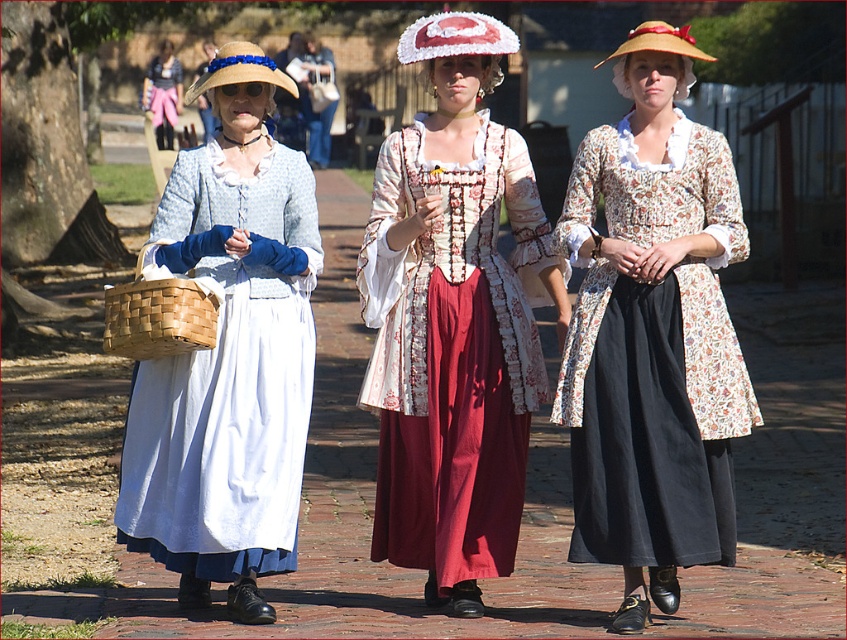
Question: Can you confirm if straw hat at center is positioned below matte blue dress at center?

Choices:
 (A) yes
 (B) no

Answer: (A)

Question: Can you confirm if straw hat at center is positioned above straw hat with blue ribbon at left?

Choices:
 (A) no
 (B) yes

Answer: (A)

Question: Does natural woven basket at left have a lesser width compared to straw hat with blue ribbon at left?

Choices:
 (A) no
 (B) yes

Answer: (B)

Question: Which point is farther to the camera?

Choices:
 (A) (641, 627)
 (B) (161, 436)
 (C) (104, 320)

Answer: (C)

Question: Which of the following is the closest to the observer?

Choices:
 (A) matte blue dress at center
 (B) natural woven basket at left
 (C) straw hat at center
 (D) floral-patterned fabric dress at center

Answer: (B)

Question: Which object is closer to the camera taking this photo?

Choices:
 (A) floral-patterned fabric dress at center
 (B) straw hat with blue ribbon at left
 (C) straw hat at center
 (D) matte blue dress at center

Answer: (C)